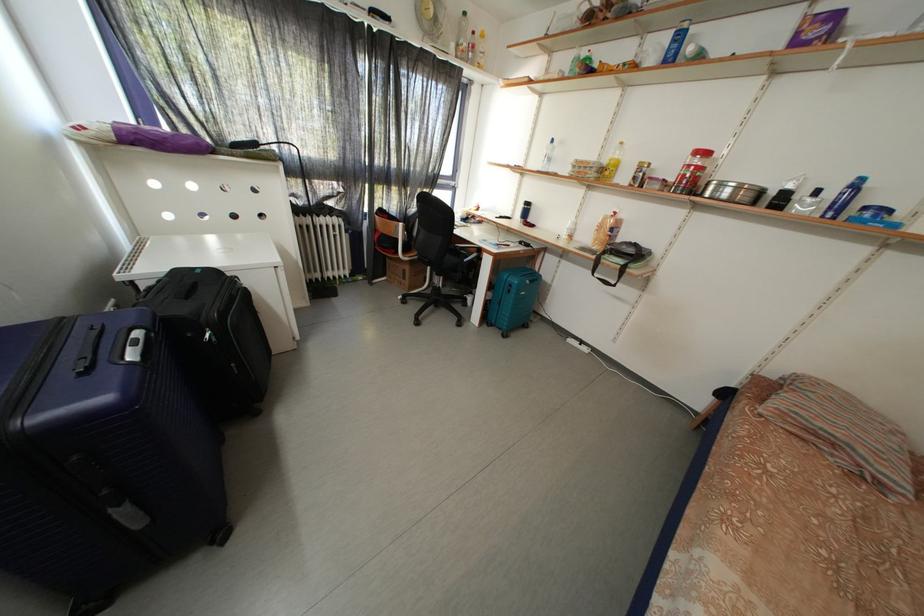
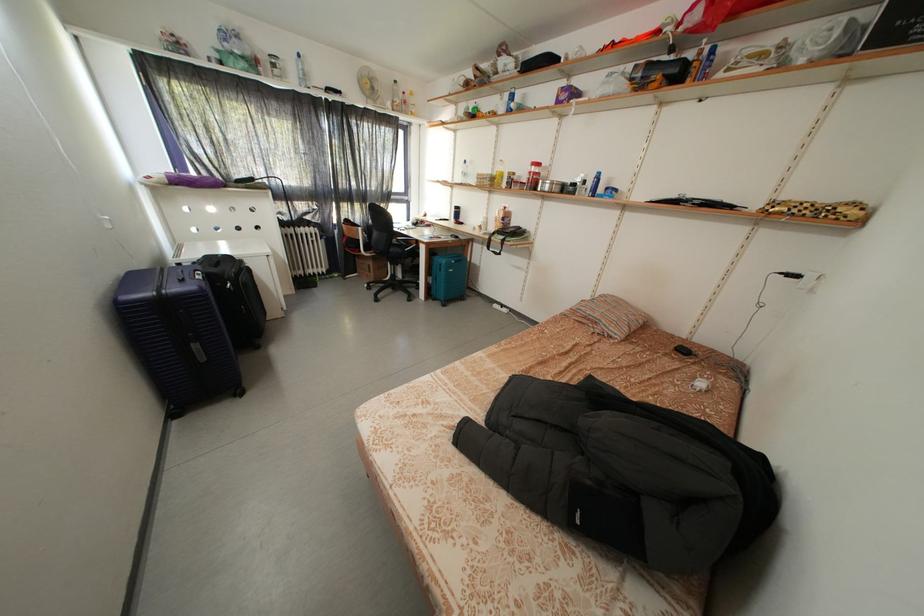
In the second image, find the point that corresponds to point (497, 330) in the first image.

(442, 305)